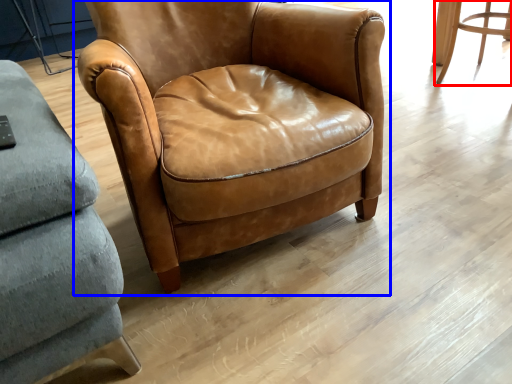
Question: Which point is closer to the camera, chair (highlighted by a red box) or chair (highlighted by a blue box)?

Choices:
 (A) chair
 (B) chair

Answer: (B)